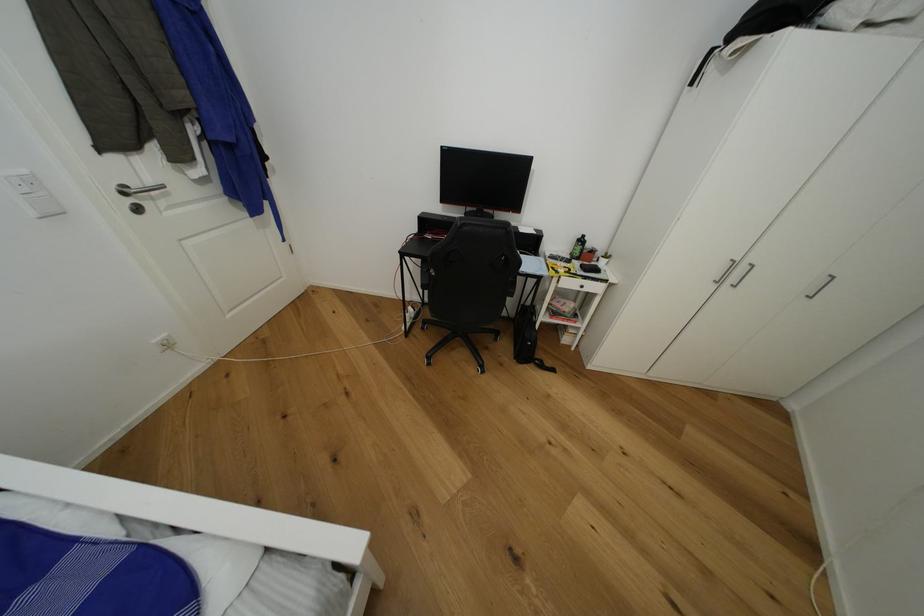
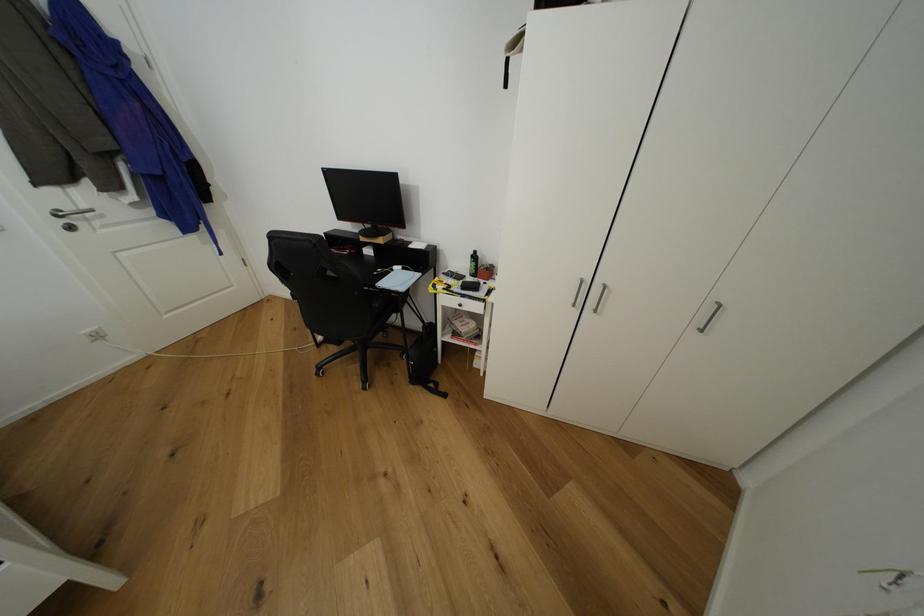
Locate, in the second image, the point that corresponds to point 568,302 in the first image.

(472, 322)